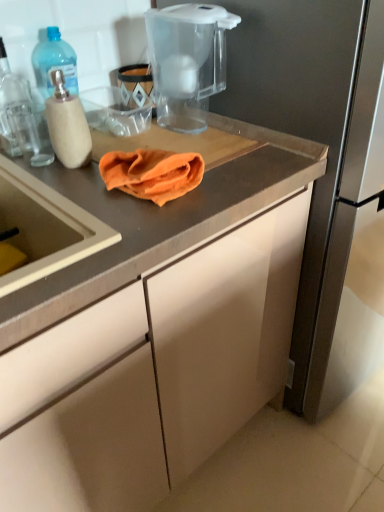
Locate an element on the screen. This screenshot has height=512, width=384. vacant region to the left of orange cloth at center is located at coordinates (64, 189).